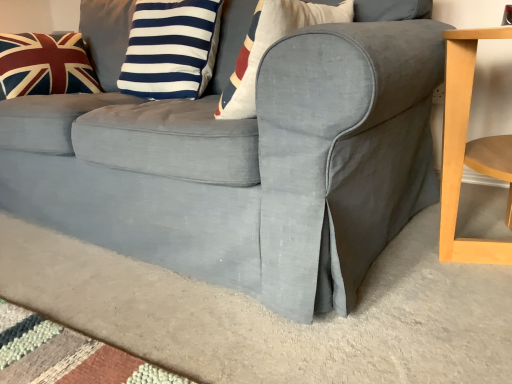
Locate an element on the screen. Image resolution: width=512 pixels, height=384 pixels. union jack fabric pillow at upper left, which ranks as the 1th pillow in left-to-right order is located at coordinates (45, 65).

What do you see at coordinates (45, 65) in the screenshot? Image resolution: width=512 pixels, height=384 pixels. I see `union jack fabric pillow at upper left, the 2th pillow when ordered from right to left` at bounding box center [45, 65].

Find the location of `blue/white striped pillow at upper center, the 2th pillow in the left-to-right sequence`. blue/white striped pillow at upper center, the 2th pillow in the left-to-right sequence is located at coordinates coord(170,48).

The width and height of the screenshot is (512, 384). What do you see at coordinates (170, 48) in the screenshot?
I see `blue/white striped pillow at upper center, acting as the 1th pillow starting from the right` at bounding box center [170, 48].

Identify the location of union jack fabric pillow at upper left, which ranks as the 1th pillow in left-to-right order. (45, 65).

Is union jack fabric pillow at upper left, which ranks as the 1th pillow in left-to-right order, to the left of blue/white striped pillow at upper center, acting as the 1th pillow starting from the right, from the viewer's perspective?

Correct, you'll find union jack fabric pillow at upper left, which ranks as the 1th pillow in left-to-right order, to the left of blue/white striped pillow at upper center, acting as the 1th pillow starting from the right.

Is the depth of union jack fabric pillow at upper left, the 2th pillow when ordered from right to left, less than that of blue/white striped pillow at upper center, the 2th pillow in the left-to-right sequence?

No, it is behind blue/white striped pillow at upper center, the 2th pillow in the left-to-right sequence.

Is point (97, 81) positioned before point (199, 35)?

That is False.

From the image's perspective, is union jack fabric pillow at upper left, which ranks as the 1th pillow in left-to-right order, located above blue/white striped pillow at upper center, acting as the 1th pillow starting from the right?

Yes.

From a real-world perspective, who is located higher, union jack fabric pillow at upper left, which ranks as the 1th pillow in left-to-right order, or blue/white striped pillow at upper center, the 2th pillow in the left-to-right sequence?

blue/white striped pillow at upper center, the 2th pillow in the left-to-right sequence, from a real-world perspective.

Considering the sizes of objects union jack fabric pillow at upper left, the 2th pillow when ordered from right to left, and blue/white striped pillow at upper center, acting as the 1th pillow starting from the right, in the image provided, who is thinner, union jack fabric pillow at upper left, the 2th pillow when ordered from right to left, or blue/white striped pillow at upper center, acting as the 1th pillow starting from the right,?

Thinner between the two is blue/white striped pillow at upper center, acting as the 1th pillow starting from the right.

Based on the photo, can you confirm if union jack fabric pillow at upper left, which ranks as the 1th pillow in left-to-right order, is shorter than blue/white striped pillow at upper center, the 2th pillow in the left-to-right sequence?

Yes, union jack fabric pillow at upper left, which ranks as the 1th pillow in left-to-right order, is shorter than blue/white striped pillow at upper center, the 2th pillow in the left-to-right sequence.

Is union jack fabric pillow at upper left, which ranks as the 1th pillow in left-to-right order, bigger or smaller than blue/white striped pillow at upper center, the 2th pillow in the left-to-right sequence?

Considering their sizes, union jack fabric pillow at upper left, which ranks as the 1th pillow in left-to-right order, takes up less space than blue/white striped pillow at upper center, the 2th pillow in the left-to-right sequence.

Is blue/white striped pillow at upper center, acting as the 1th pillow starting from the right, surrounded by union jack fabric pillow at upper left, which ranks as the 1th pillow in left-to-right order?

No, blue/white striped pillow at upper center, acting as the 1th pillow starting from the right, is located outside of union jack fabric pillow at upper left, which ranks as the 1th pillow in left-to-right order.

Is union jack fabric pillow at upper left, which ranks as the 1th pillow in left-to-right order, in contact with blue/white striped pillow at upper center, acting as the 1th pillow starting from the right?

No.

Looking at this image, could you tell me if union jack fabric pillow at upper left, which ranks as the 1th pillow in left-to-right order, is turned towards blue/white striped pillow at upper center, the 2th pillow in the left-to-right sequence?

Yes.

What's the angular difference between union jack fabric pillow at upper left, the 2th pillow when ordered from right to left, and blue/white striped pillow at upper center, the 2th pillow in the left-to-right sequence,'s facing directions?

The facing directions of union jack fabric pillow at upper left, the 2th pillow when ordered from right to left, and blue/white striped pillow at upper center, the 2th pillow in the left-to-right sequence, are 89.9 degrees apart.

Identify the location of pillow on the left of blue/white striped pillow at upper center, the 2th pillow in the left-to-right sequence. Image resolution: width=512 pixels, height=384 pixels. (45, 65).

From the picture: Can you confirm if blue/white striped pillow at upper center, acting as the 1th pillow starting from the right, is positioned to the right of union jack fabric pillow at upper left, which ranks as the 1th pillow in left-to-right order?

Yes.

Which is behind, blue/white striped pillow at upper center, the 2th pillow in the left-to-right sequence, or union jack fabric pillow at upper left, the 2th pillow when ordered from right to left?

Positioned behind is union jack fabric pillow at upper left, the 2th pillow when ordered from right to left.

Does point (219, 6) lie behind point (52, 54)?

No, it is not.

From the image's perspective, is blue/white striped pillow at upper center, the 2th pillow in the left-to-right sequence, on union jack fabric pillow at upper left, which ranks as the 1th pillow in left-to-right order?

Incorrect, from the image's perspective, blue/white striped pillow at upper center, the 2th pillow in the left-to-right sequence, is lower than union jack fabric pillow at upper left, which ranks as the 1th pillow in left-to-right order.

From a real-world perspective, relative to union jack fabric pillow at upper left, the 2th pillow when ordered from right to left, is blue/white striped pillow at upper center, acting as the 1th pillow starting from the right, vertically above or below?

From a real-world perspective, blue/white striped pillow at upper center, acting as the 1th pillow starting from the right, is physically above union jack fabric pillow at upper left, the 2th pillow when ordered from right to left.

Which object is wider, blue/white striped pillow at upper center, the 2th pillow in the left-to-right sequence, or union jack fabric pillow at upper left, which ranks as the 1th pillow in left-to-right order?

union jack fabric pillow at upper left, which ranks as the 1th pillow in left-to-right order, is wider.

Considering the sizes of objects blue/white striped pillow at upper center, the 2th pillow in the left-to-right sequence, and union jack fabric pillow at upper left, which ranks as the 1th pillow in left-to-right order, in the image provided, who is taller, blue/white striped pillow at upper center, the 2th pillow in the left-to-right sequence, or union jack fabric pillow at upper left, which ranks as the 1th pillow in left-to-right order,?

blue/white striped pillow at upper center, the 2th pillow in the left-to-right sequence.

Considering the relative sizes of blue/white striped pillow at upper center, acting as the 1th pillow starting from the right, and union jack fabric pillow at upper left, the 2th pillow when ordered from right to left, in the image provided, is blue/white striped pillow at upper center, acting as the 1th pillow starting from the right, smaller than union jack fabric pillow at upper left, the 2th pillow when ordered from right to left,?

No, blue/white striped pillow at upper center, acting as the 1th pillow starting from the right, is not smaller than union jack fabric pillow at upper left, the 2th pillow when ordered from right to left.

Could union jack fabric pillow at upper left, which ranks as the 1th pillow in left-to-right order, be considered to be inside blue/white striped pillow at upper center, the 2th pillow in the left-to-right sequence?

No, union jack fabric pillow at upper left, which ranks as the 1th pillow in left-to-right order, is located outside of blue/white striped pillow at upper center, the 2th pillow in the left-to-right sequence.

Based on the photo, are blue/white striped pillow at upper center, acting as the 1th pillow starting from the right, and union jack fabric pillow at upper left, the 2th pillow when ordered from right to left, far apart?

No, blue/white striped pillow at upper center, acting as the 1th pillow starting from the right, is not far from union jack fabric pillow at upper left, the 2th pillow when ordered from right to left.

Could you tell me if blue/white striped pillow at upper center, the 2th pillow in the left-to-right sequence, is facing union jack fabric pillow at upper left, which ranks as the 1th pillow in left-to-right order?

No, blue/white striped pillow at upper center, the 2th pillow in the left-to-right sequence, is not oriented towards union jack fabric pillow at upper left, which ranks as the 1th pillow in left-to-right order.

How many degrees apart are the facing directions of blue/white striped pillow at upper center, the 2th pillow in the left-to-right sequence, and union jack fabric pillow at upper left, the 2th pillow when ordered from right to left?

89.9 degrees separate the facing orientations of blue/white striped pillow at upper center, the 2th pillow in the left-to-right sequence, and union jack fabric pillow at upper left, the 2th pillow when ordered from right to left.

Identify the location of pillow on the left side of blue/white striped pillow at upper center, acting as the 1th pillow starting from the right. (45, 65).

This screenshot has width=512, height=384. What are the coordinates of `pillow above the blue/white striped pillow at upper center, the 2th pillow in the left-to-right sequence (from the image's perspective)` in the screenshot? It's located at point(45,65).

Locate an element on the screen. pillow on the right of union jack fabric pillow at upper left, the 2th pillow when ordered from right to left is located at coordinates (170, 48).